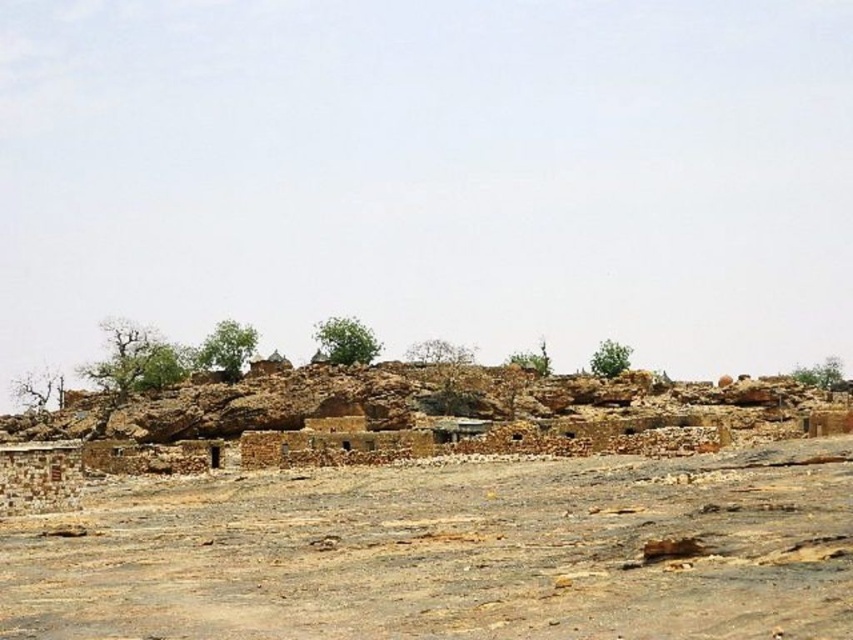
Consider the image. Which of these two, brown sandy dirt field at lower center or brown mud-brick village at center, stands shorter?

With less height is brown sandy dirt field at lower center.

Which is more to the left, brown sandy dirt field at lower center or brown mud-brick village at center?

From the viewer's perspective, brown sandy dirt field at lower center appears more on the left side.

Does point (762, 602) come behind point (563, 396)?

No.

The height and width of the screenshot is (640, 853). I want to click on brown sandy dirt field at lower center, so click(451, 554).